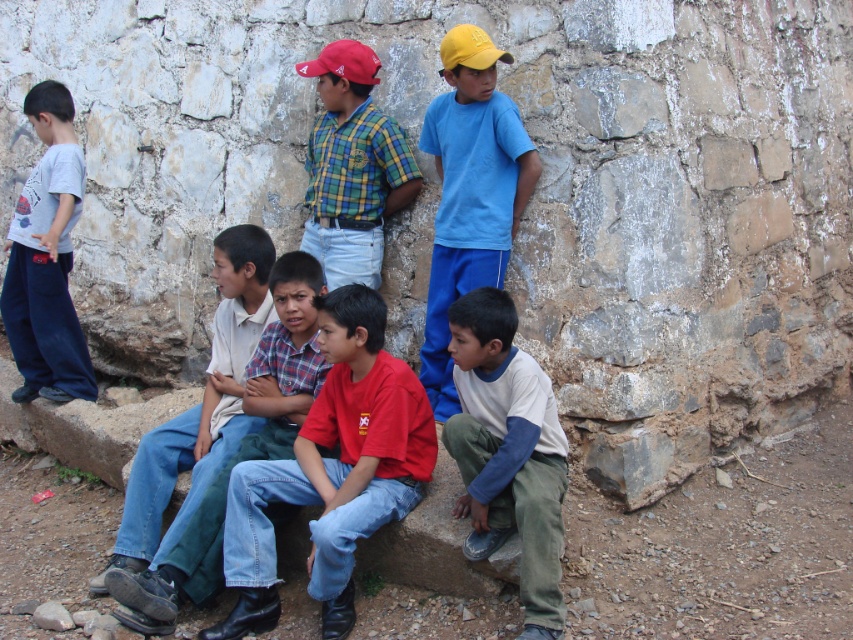
Who is shorter, white fleece pants at lower right or blue cotton shirt at upper center?

With less height is white fleece pants at lower right.

Who is more forward, (503, 480) or (491, 60)?

Point (503, 480) is in front.

This screenshot has width=853, height=640. Describe the element at coordinates (508, 451) in the screenshot. I see `white fleece pants at lower right` at that location.

You are a GUI agent. You are given a task and a screenshot of the screen. Output one action in this format:
    pyautogui.click(x=<x>, y=<y>)
    Task: Click on the white fleece pants at lower right
    The image size is (853, 640).
    Given the screenshot: What is the action you would take?
    pyautogui.click(x=508, y=451)

Does point (33, 99) lie behind point (505, 56)?

That is True.

Can you confirm if matte gray t-shirt at left is thinner than yellow matte baseball cap at upper center?

No.

Who is more distant from viewer, (47, 348) or (440, 49)?

The point (47, 348) is more distant.

Find the location of a particular element. matte gray t-shirt at left is located at coordinates (45, 259).

In the scene shown: Between blue cotton shirt at upper center and yellow matte baseball cap at upper center, which one is positioned lower?

blue cotton shirt at upper center is lower down.

Is point (503, 243) closer to camera compared to point (461, 56)?

No, (503, 243) is further to viewer.

Who is more forward, (454,58) or (468,52)?

Point (468,52) is in front.

At what (x,y) coordinates should I click in order to perform the action: click on blue cotton shirt at upper center. Please return your answer as a coordinate pair (x, y). The image size is (853, 640). Looking at the image, I should click on (469, 192).